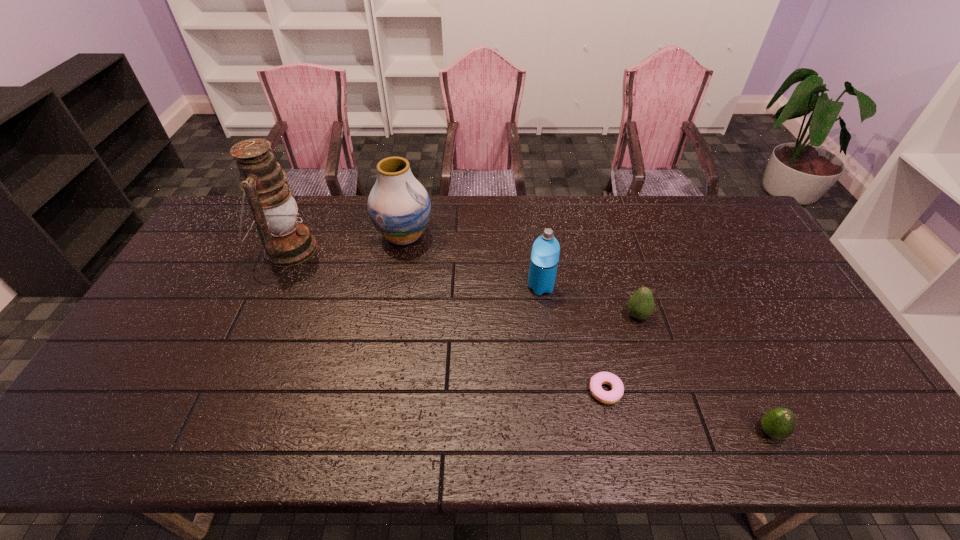
At what (x,y) coordinates should I click in order to perform the action: click on free point that satisfies the following two spatial constraints: 1. on the back side of the leftmost object; 2. on the left side of the fifth shortest object. Please return your answer as a coordinate pair (x, y). This screenshot has height=540, width=960. Looking at the image, I should click on (295, 236).